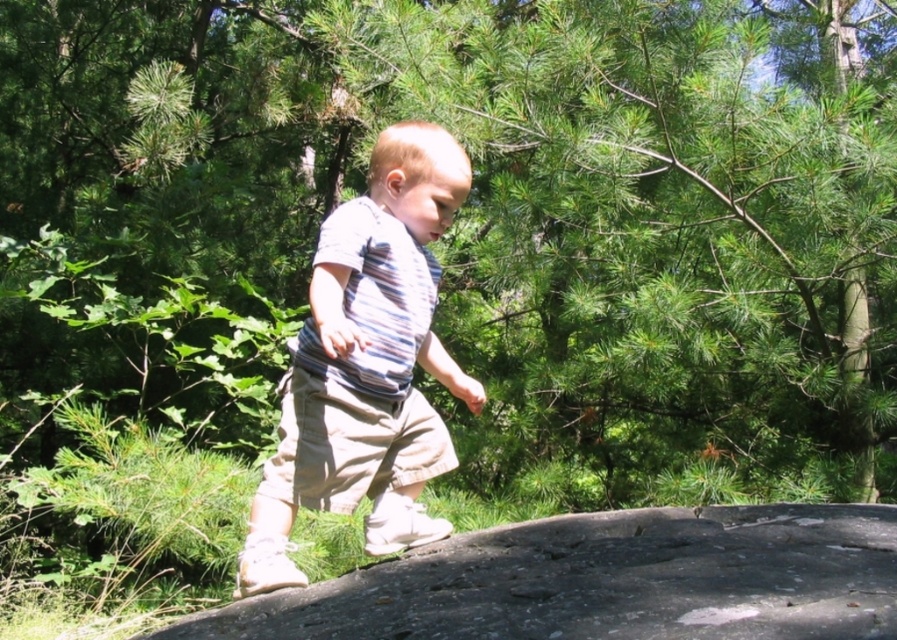
Question: Among these objects, which one is farthest from the camera?

Choices:
 (A) striped cotton shirt at center
 (B) smooth gray rock at center

Answer: (A)

Question: Which of the following is the farthest from the observer?

Choices:
 (A) smooth gray rock at center
 (B) striped cotton shirt at center

Answer: (B)

Question: Can you confirm if smooth gray rock at center is wider than striped cotton shirt at center?

Choices:
 (A) yes
 (B) no

Answer: (A)

Question: From the image, what is the correct spatial relationship of smooth gray rock at center in relation to striped cotton shirt at center?

Choices:
 (A) left
 (B) right

Answer: (B)

Question: From the image, what is the correct spatial relationship of smooth gray rock at center in relation to striped cotton shirt at center?

Choices:
 (A) above
 (B) below

Answer: (B)

Question: Which point is closer to the camera?

Choices:
 (A) (625, 552)
 (B) (370, 458)

Answer: (A)